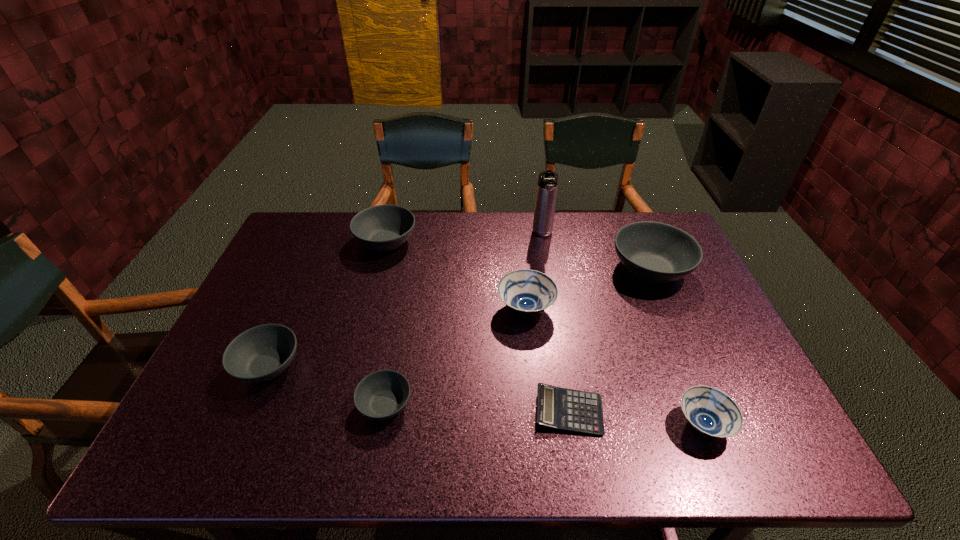
Where is `free area in between the rightmost gray soup bowl and the second shortest object`? The image size is (960, 540). free area in between the rightmost gray soup bowl and the second shortest object is located at coordinates (517, 337).

Identify which object is the fourth closest to the biggest gray soup bowl. Please provide its 2D coordinates. Your answer should be formatted as a tuple, i.e. [(x, y)], where the tuple contains the x and y coordinates of a point satisfying the conditions above.

[(711, 412)]

Image resolution: width=960 pixels, height=540 pixels. Find the location of `object that is the third nearest to the seventh shortest object`. object that is the third nearest to the seventh shortest object is located at coordinates (559, 408).

The image size is (960, 540). Identify the location of the closest soup bowl to the tallest object. (657, 253).

I want to click on soup bowl identified as the second closest to the shortest soup bowl, so click(526, 292).

This screenshot has height=540, width=960. I want to click on gray soup bowl object that ranks as the second closest to the seventh shortest object, so click(380, 395).

You are a GUI agent. You are given a task and a screenshot of the screen. Output one action in this format:
    pyautogui.click(x=<x>, y=<y>)
    Task: Click on the gray soup bowl that stands as the second closest to the second tallest object
    The image size is (960, 540).
    Given the screenshot: What is the action you would take?
    pyautogui.click(x=380, y=395)

I want to click on free space that satisfies the following two spatial constraints: 1. on the back side of the calculator; 2. on the right side of the tallest soup bowl, so click(545, 269).

I want to click on blank space that satisfies the following two spatial constraints: 1. on the handle side of the biggest gray soup bowl; 2. on the right side of the thermos bottle, so click(549, 269).

The width and height of the screenshot is (960, 540). I want to click on free location that satisfies the following two spatial constraints: 1. on the back side of the second biggest gray soup bowl; 2. on the right side of the leftmost gray soup bowl, so click(x=323, y=241).